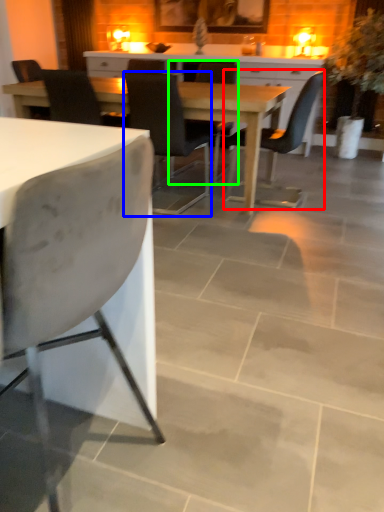
Question: Which object is the closest to the chair (highlighted by a red box)? Choose among these: chair (highlighted by a blue box) or chair (highlighted by a green box).

Choices:
 (A) chair
 (B) chair

Answer: (B)